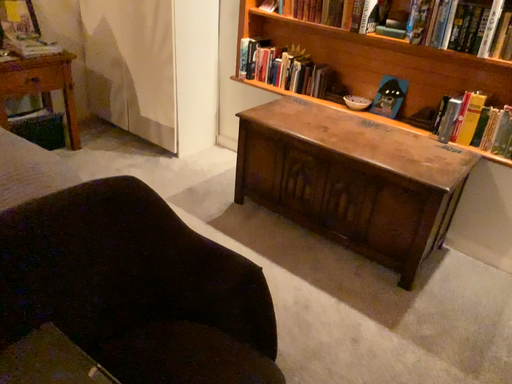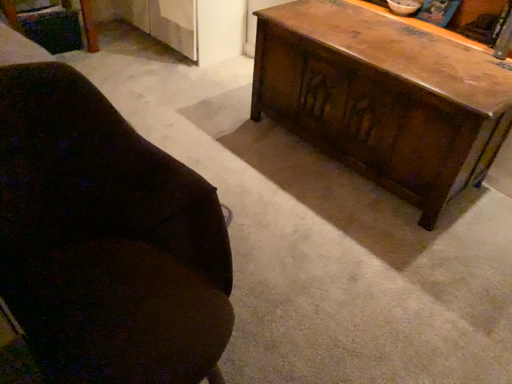
Question: Which way did the camera rotate in the video?

Choices:
 (A) rotated upward
 (B) rotated downward

Answer: (B)